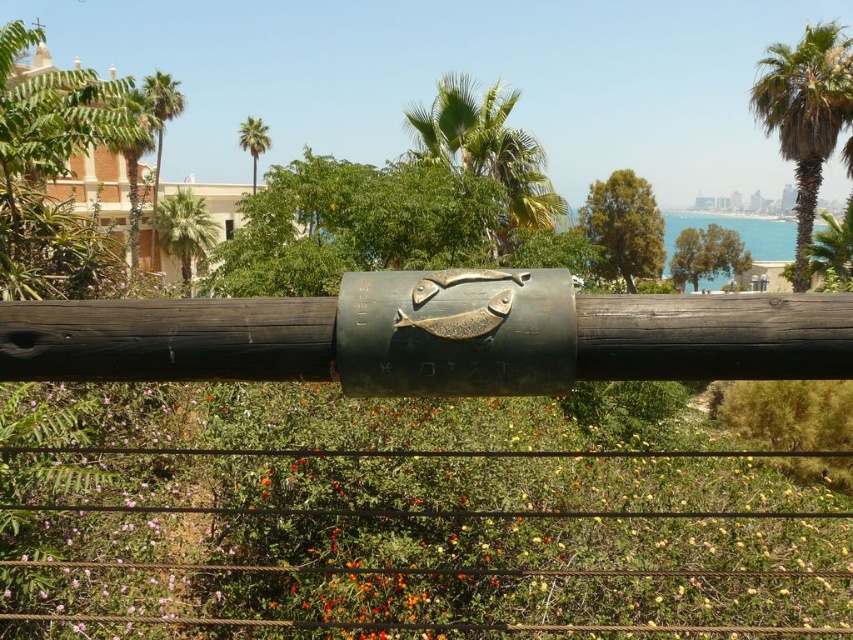
Based on the photo, is brown wire fence at center positioned behind green leafy palm tree at upper center?

No, it is in front of green leafy palm tree at upper center.

Who is higher up, brown wire fence at center or green leafy palm tree at upper center?

green leafy palm tree at upper center is higher up.

The image size is (853, 640). What do you see at coordinates (421, 452) in the screenshot?
I see `brown wire fence at center` at bounding box center [421, 452].

I want to click on brown wire fence at center, so click(x=421, y=452).

Is point (634, 259) positioned in front of point (242, 122)?

Yes, it is in front of point (242, 122).

Is point (610, 276) farther from camera compared to point (242, 148)?

Yes, it is behind point (242, 148).

Is point (625, 186) more distant than point (270, 147)?

No, it is not.

At what (x,y) coordinates should I click in order to perform the action: click on green leafy tree at center. Please return your answer as a coordinate pair (x, y). The width and height of the screenshot is (853, 640). Looking at the image, I should click on (624, 227).

Is bronze textured pole at center to the left of green leafy palm at upper center from the viewer's perspective?

In fact, bronze textured pole at center is to the right of green leafy palm at upper center.

Consider the image. Is bronze textured pole at center in front of green leafy palm at upper center?

Yes, bronze textured pole at center is in front of green leafy palm at upper center.

Which is behind, point (276, 364) or point (258, 156)?

Positioned behind is point (258, 156).

This screenshot has height=640, width=853. What are the coordinates of `bronze textured pole at center` in the screenshot? It's located at pos(424,342).